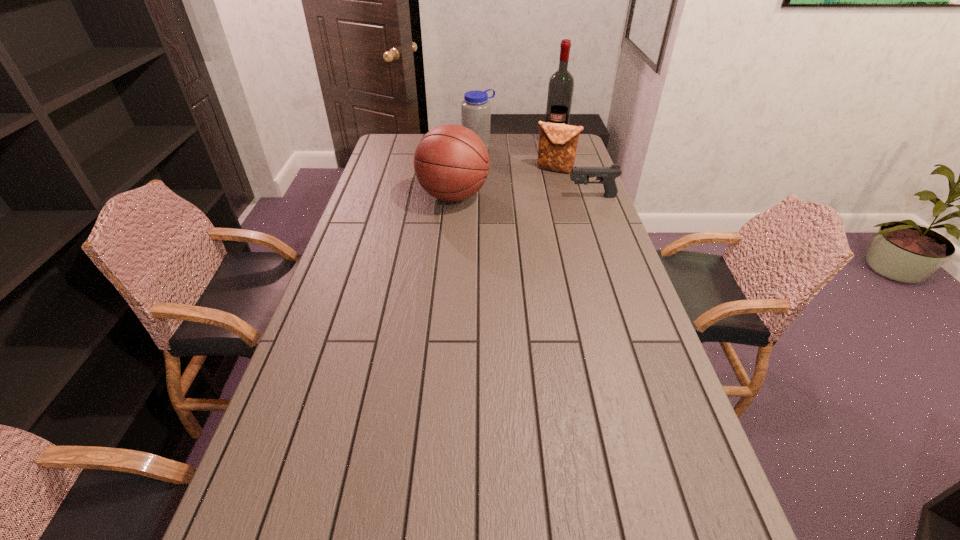
This screenshot has height=540, width=960. In order to click on free spot on the desktop that is between the basketball and the shortest object and is positioned on the open side of the second shortest object in this screenshot , I will do `click(536, 197)`.

Where is `vacant space on the desktop that is between the basketball and the pistol and is positioned on the front and back of the tallest object`? The image size is (960, 540). vacant space on the desktop that is between the basketball and the pistol and is positioned on the front and back of the tallest object is located at coordinates (536, 197).

Locate an element on the screen. Image resolution: width=960 pixels, height=540 pixels. free spot on the desktop that is between the basketball and the pistol and is positioned with a carrying loop on the side of the water bottle is located at coordinates (539, 197).